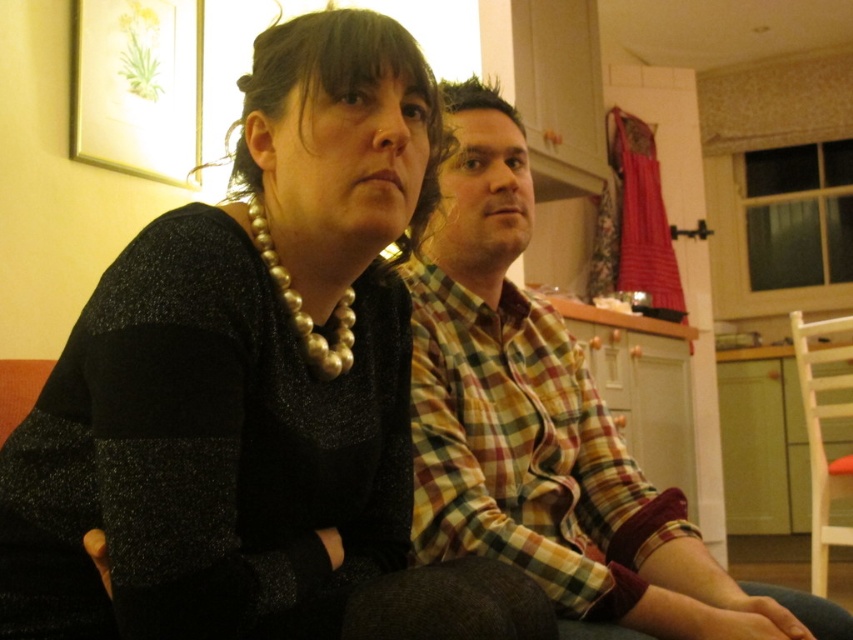
Question: Is checkered fabric shirt at center further to camera compared to plaid fabric shirt at center?

Choices:
 (A) yes
 (B) no

Answer: (B)

Question: Which of the following is the farthest from the observer?

Choices:
 (A) (432, 269)
 (B) (421, 538)

Answer: (A)

Question: Is checkered fabric shirt at center positioned before plaid fabric shirt at center?

Choices:
 (A) yes
 (B) no

Answer: (A)

Question: Is checkered fabric shirt at center wider than plaid fabric shirt at center?

Choices:
 (A) yes
 (B) no

Answer: (A)